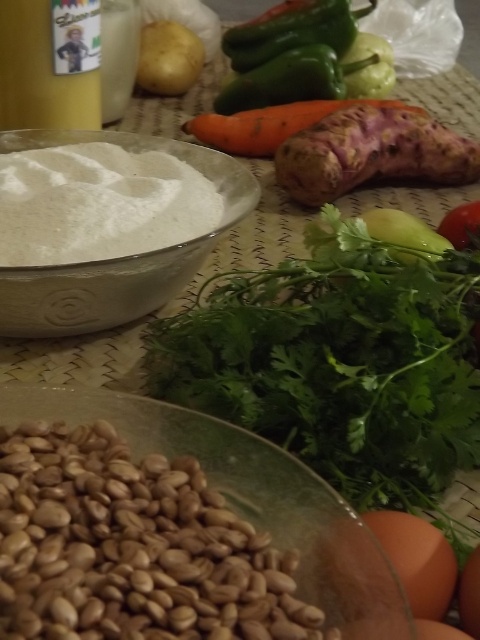
Which is more to the left, green matte pepper at upper center or smooth yellow potato at upper left?

smooth yellow potato at upper left is more to the left.

Which is behind, point (225, 36) or point (192, 32)?

The point (192, 32) is behind.

Locate an element on the screen. The width and height of the screenshot is (480, 640). green matte pepper at upper center is located at coordinates (292, 32).

Is orange matte egg at lower right to the right of orange matte carrot at center from the viewer's perspective?

In fact, orange matte egg at lower right is to the left of orange matte carrot at center.

Describe the element at coordinates (417, 560) in the screenshot. Image resolution: width=480 pixels, height=640 pixels. I see `orange matte egg at lower right` at that location.

Locate an element on the screen. orange matte egg at lower right is located at coordinates (417, 560).

Does point (145, 84) come in front of point (474, 586)?

No, (145, 84) is behind (474, 586).

Locate an element on the screen. The image size is (480, 640). smooth yellow potato at upper left is located at coordinates (168, 58).